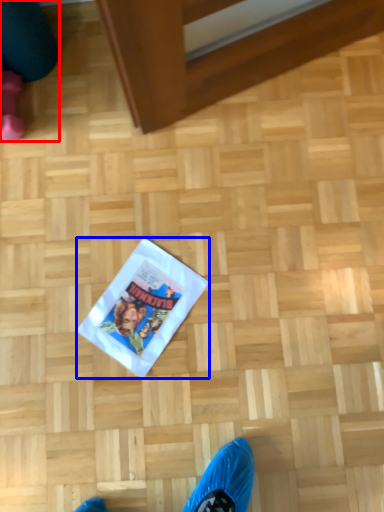
Question: Among these objects, which one is farthest to the camera, leg (highlighted by a red box) or flyer (highlighted by a blue box)?

Choices:
 (A) leg
 (B) flyer

Answer: (B)